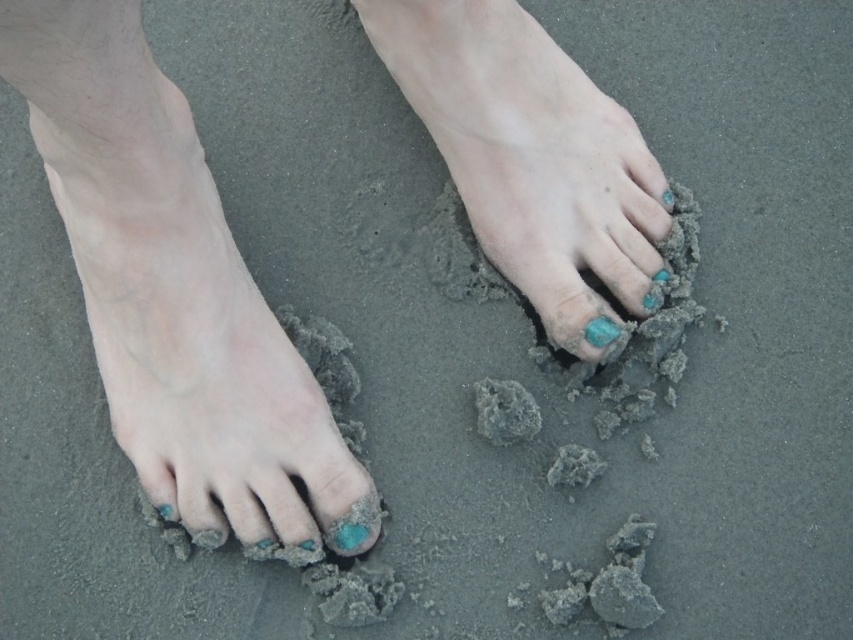
The width and height of the screenshot is (853, 640). Describe the element at coordinates (170, 285) in the screenshot. I see `teal matte nails at center` at that location.

This screenshot has width=853, height=640. I want to click on teal matte nails at center, so (170, 285).

Identify the location of teal matte nails at center. (170, 285).

Is teal polished nails at center positioned in front of matte turquoise stone at center?

Yes, teal polished nails at center is closer to the viewer.

Which is in front, point (622, 122) or point (608, 330)?

Point (608, 330) is in front.

What are the coordinates of `teal polished nails at center` in the screenshot? It's located at (531, 156).

Which is behind, point (274, 493) or point (364, 522)?

The point (364, 522) is more distant.

Is point (141, 348) positioned behind point (350, 541)?

No, it is not.

This screenshot has height=640, width=853. I want to click on teal matte nails at center, so click(170, 285).

Image resolution: width=853 pixels, height=640 pixels. I want to click on teal matte nails at center, so click(170, 285).